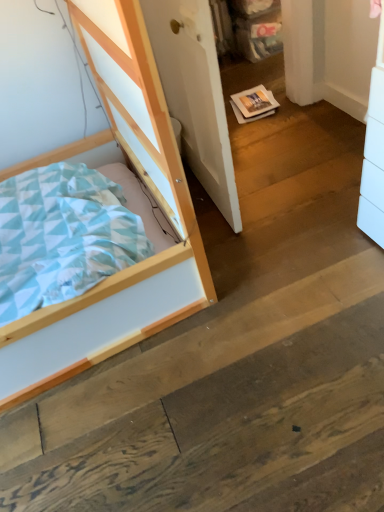
You are a GUI agent. You are given a task and a screenshot of the screen. Output one action in this format:
    pyautogui.click(x=<x>, y=<y>)
    Task: Click on the vacant point to the right of white matte door at center
    The image size is (384, 512).
    Given the screenshot: What is the action you would take?
    pyautogui.click(x=289, y=161)